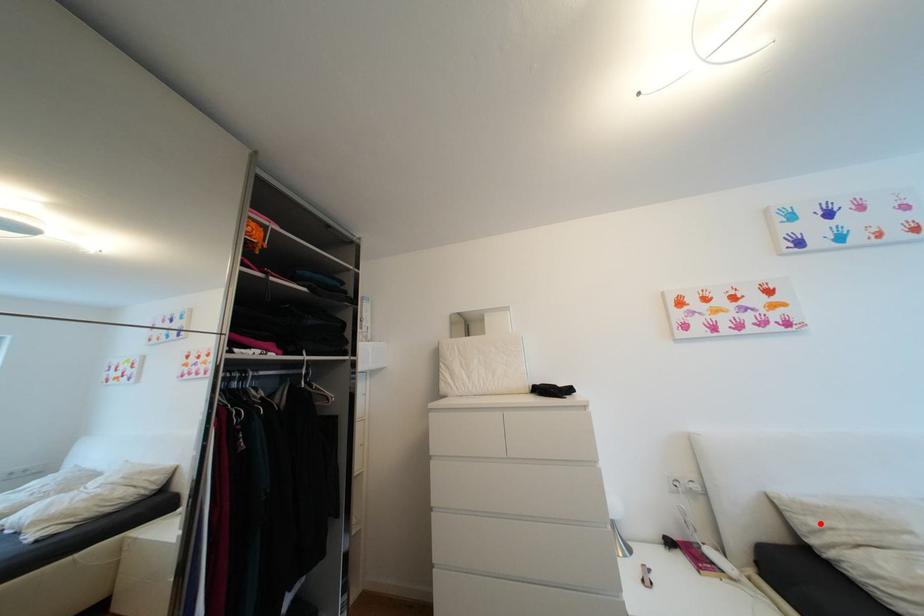
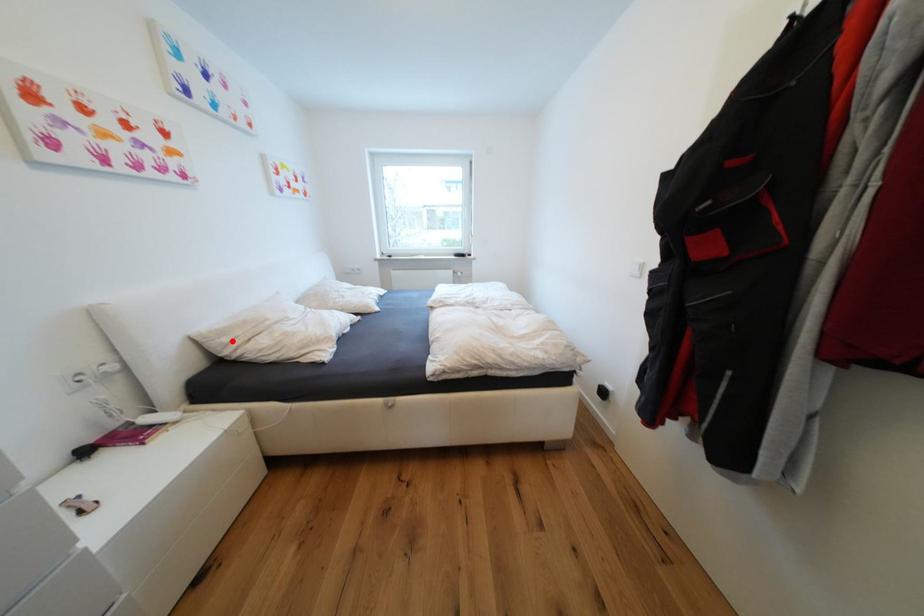
I am providing you with two images of the same scene from different viewpoints. A red point is marked on the first image and another point is marked on the second image. Is the marked point in image1 the same physical position as the marked point in image2?

Yes